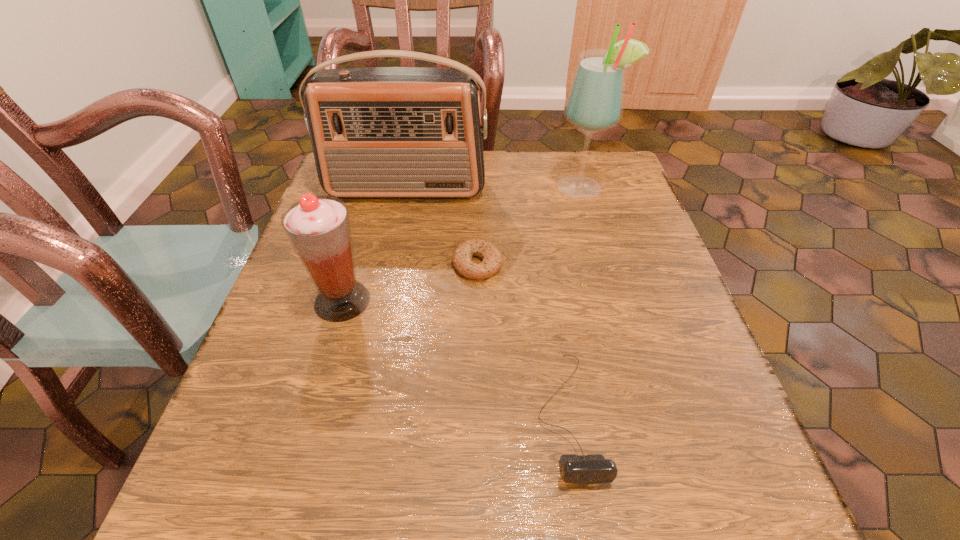
The width and height of the screenshot is (960, 540). I want to click on the rightmost object, so click(x=595, y=101).

The height and width of the screenshot is (540, 960). I want to click on the tallest object, so click(x=595, y=101).

Where is `the fourth shortest object`? the fourth shortest object is located at coordinates (380, 132).

Locate an element on the screen. the third shortest object is located at coordinates (318, 227).

Locate an element on the screen. The image size is (960, 540). webcam is located at coordinates (592, 468).

The width and height of the screenshot is (960, 540). I want to click on the second object from right to left, so click(x=592, y=468).

Locate an element on the screen. The image size is (960, 540). the shortest object is located at coordinates (492, 260).

This screenshot has width=960, height=540. What are the coordinates of `vacant space located 0.060m on the right of the tallest object` in the screenshot? It's located at (635, 188).

Locate an element on the screen. vacant position located 0.310m on the front-facing side of the second tallest object is located at coordinates (383, 300).

Locate an element on the screen. vacant space located 0.380m on the right of the smoothie is located at coordinates (570, 301).